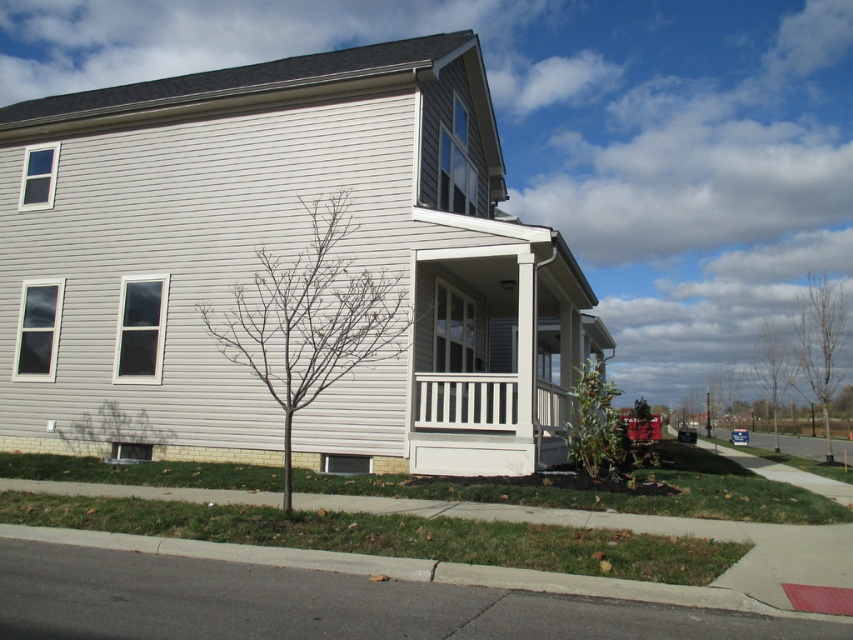
You are planning to plant a new tree in your backyard. You have two options based on the image provided. The first option is the bare branches at lower center, and the second is the bare wood tree at right. Which tree would you choose if you want a smaller tree for space constraints?

The bare branches at lower center has a smaller size compared to the bare wood tree at right, so it is the better choice for space constraints.

You are standing at the front lawn of the house and want to water the green leafy plant at lower right. If your watering can has a range of 30 feet, can you reach it without moving closer?

The green leafy plant at lower right is 36.51 feet away from the viewer. Since the watering can only reaches 30 feet, you cannot water it without moving closer.

You are standing on the lawn in front of the house and see the bare branches at lower center and the green leafy plant at lower right. Which one is located to the right of the other?

The green leafy plant at lower right is located to the right of the bare branches at lower center.